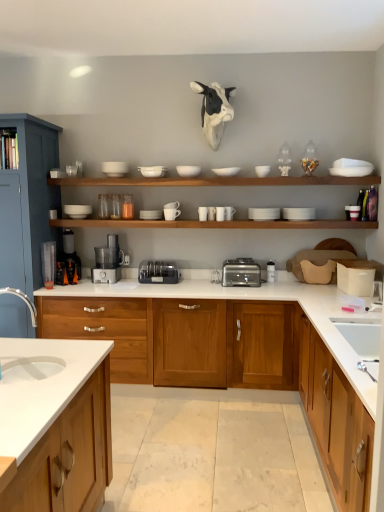
Question: Does white matte bowl at upper center, the fifth tableware when ordered from left to right, have a larger size compared to white matte bowl at upper center, the eleventh tableware when ordered from right to left?

Choices:
 (A) yes
 (B) no

Answer: (B)

Question: Is white matte bowl at upper center, the fifth tableware when ordered from left to right, looking in the opposite direction of white matte bowl at upper center, which ranks as the fourth tableware in left-to-right order?

Choices:
 (A) no
 (B) yes

Answer: (A)

Question: Is white matte bowl at upper center, placed as the tenth tableware when sorted from right to left, shorter than white matte bowl at upper center, the eleventh tableware when ordered from right to left?

Choices:
 (A) no
 (B) yes

Answer: (B)

Question: Is white matte bowl at upper center, placed as the tenth tableware when sorted from right to left, at the left side of white matte bowl at upper center, which ranks as the fourth tableware in left-to-right order?

Choices:
 (A) yes
 (B) no

Answer: (B)

Question: Are white matte bowl at upper center, the fifth tableware when ordered from left to right, and white matte bowl at upper center, the eleventh tableware when ordered from right to left, located far from each other?

Choices:
 (A) yes
 (B) no

Answer: (B)

Question: From a real-world perspective, is satin black blender at center physically located above or below white matte bowl at upper center, which ranks as the ninth tableware in left-to-right order?

Choices:
 (A) below
 (B) above

Answer: (A)

Question: Is satin black blender at center inside the boundaries of white matte bowl at upper center, which ranks as the ninth tableware in left-to-right order, or outside?

Choices:
 (A) inside
 (B) outside

Answer: (B)

Question: Does point (162, 266) appear closer or farther from the camera than point (218, 170)?

Choices:
 (A) closer
 (B) farther

Answer: (B)

Question: Relative to white matte bowl at upper center, which ranks as the ninth tableware in left-to-right order, is satin black blender at center in front or behind?

Choices:
 (A) front
 (B) behind

Answer: (B)

Question: In terms of width, does white matte cup at center, the seventh tableware in the left-to-right sequence, look wider or thinner when compared to brushed metal cabinet at left, positioned as the third cabinetry in right-to-left order?

Choices:
 (A) wide
 (B) thin

Answer: (B)

Question: Which is correct: white matte cup at center, the 8th tableware when ordered from right to left, is inside brushed metal cabinet at left, the 1th cabinetry when ordered from left to right, or outside of it?

Choices:
 (A) inside
 (B) outside

Answer: (B)

Question: Is white matte cup at center, the seventh tableware in the left-to-right sequence, in front of or behind brushed metal cabinet at left, positioned as the third cabinetry in right-to-left order, in the image?

Choices:
 (A) front
 (B) behind

Answer: (B)

Question: From their relative heights in the image, would you say white matte cup at center, the 8th tableware when ordered from right to left, is taller or shorter than brushed metal cabinet at left, positioned as the third cabinetry in right-to-left order?

Choices:
 (A) tall
 (B) short

Answer: (B)

Question: Is white matte cup at center, which is counted as the seventh tableware, starting from the right, in front of or behind silver metallic toaster at center in the image?

Choices:
 (A) behind
 (B) front

Answer: (A)

Question: In terms of height, does white matte cup at center, which is counted as the seventh tableware, starting from the right, look taller or shorter compared to silver metallic toaster at center?

Choices:
 (A) tall
 (B) short

Answer: (B)